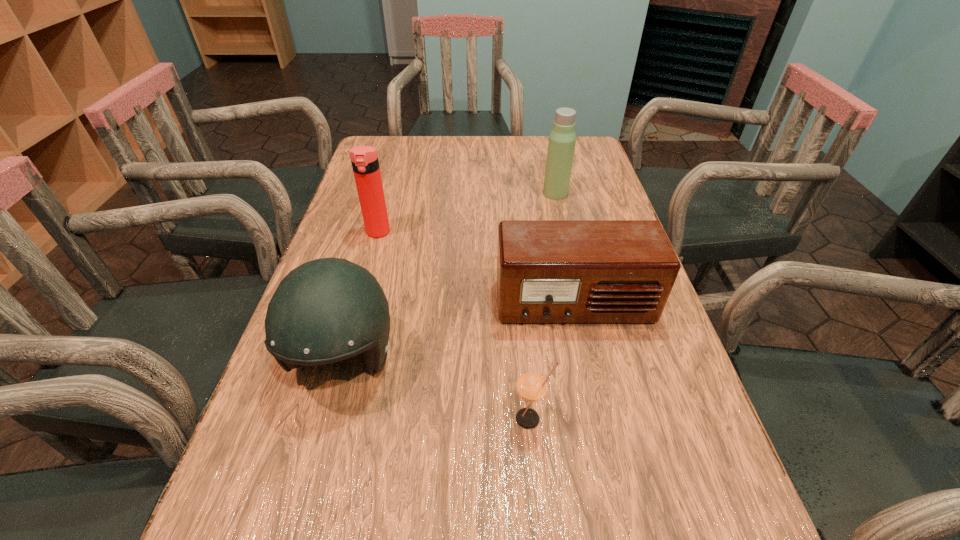
What are the coordinates of `free space at the far right corner of the desktop` in the screenshot? It's located at (544, 149).

Find the location of a particular element. This screenshot has height=540, width=960. empty space that is in between the straw and the football helmet is located at coordinates pyautogui.click(x=437, y=389).

At what (x,y) coordinates should I click in order to perform the action: click on blank region between the farther thermos bottle and the nearer thermos bottle. Please return your answer as a coordinate pair (x, y). This screenshot has width=960, height=540. Looking at the image, I should click on (467, 213).

Identify the location of unoccupied area between the straw and the football helmet. This screenshot has width=960, height=540. (437, 389).

Identify the location of free space between the radio receiver and the football helmet. The height and width of the screenshot is (540, 960). (459, 332).

At what (x,y) coordinates should I click in order to perform the action: click on vacant region between the radio receiver and the fourth nearest object. Please return your answer as a coordinate pair (x, y). This screenshot has height=540, width=960. Looking at the image, I should click on (476, 268).

Where is `vacant area that lies between the football helmet and the straw`? The width and height of the screenshot is (960, 540). vacant area that lies between the football helmet and the straw is located at coordinates (437, 389).

Locate which object is the third closest to the football helmet. Please provide its 2D coordinates. Your answer should be formatted as a tuple, i.e. [(x, y)], where the tuple contains the x and y coordinates of a point satisfying the conditions above.

[(364, 159)]

Locate an element on the screen. The image size is (960, 540). object that is the closest to the straw is located at coordinates (548, 271).

Locate an element on the screen. free spot that satisfies the following two spatial constraints: 1. at the face opening of the football helmet; 2. on the left side of the straw is located at coordinates (326, 418).